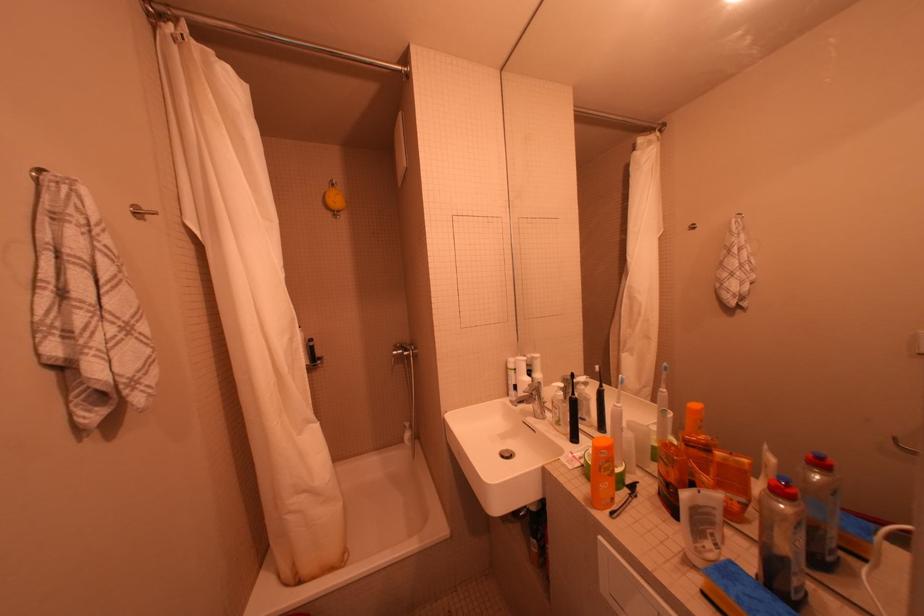
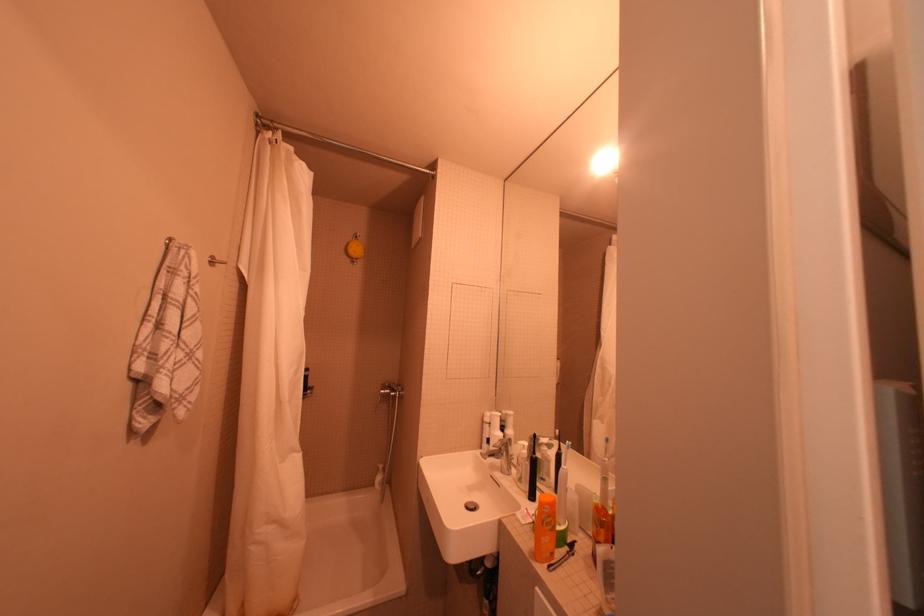
Locate, in the second image, the point that corresponds to the point at 415,351 in the first image.

(402, 391)